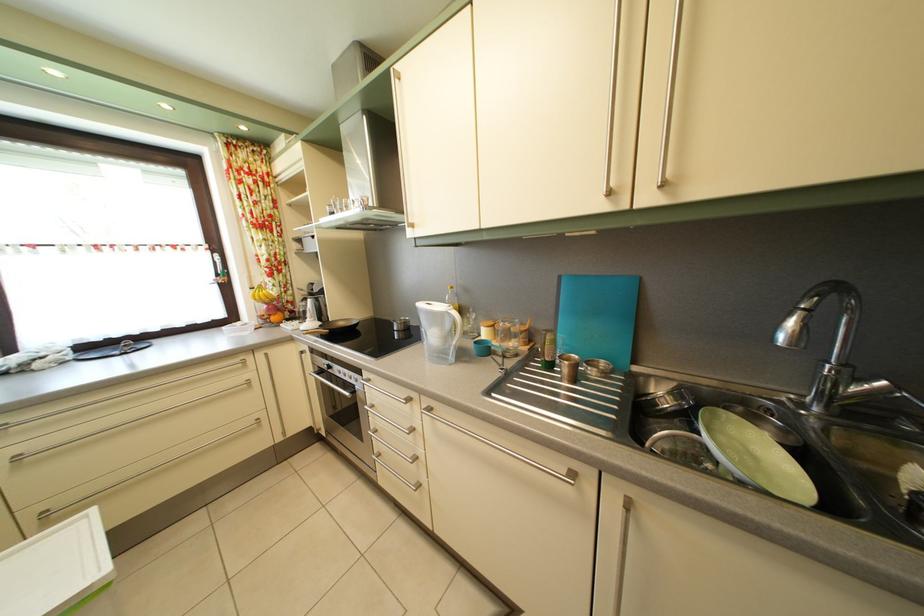
Image resolution: width=924 pixels, height=616 pixels. What are the coordinates of `green patterned plate` in the screenshot? It's located at (755, 456).